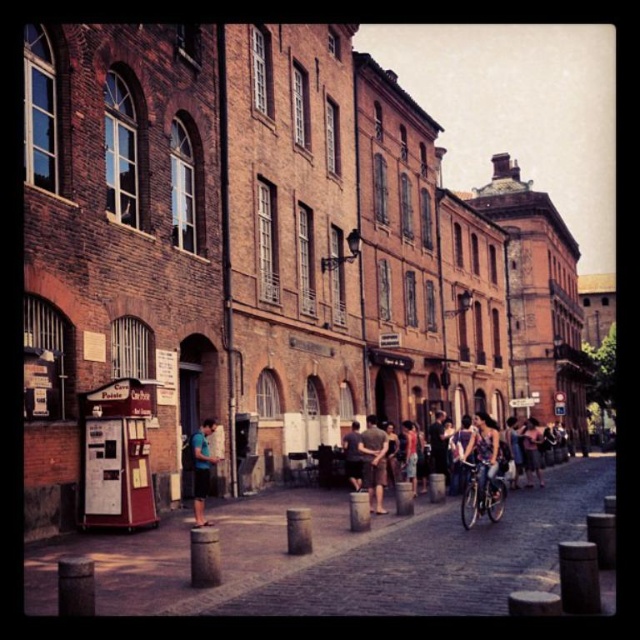
You are a delivery person who needs to park your matte purple bicycle at center near the kiosk labeled Cave Poivr?e. Is the bicycle currently positioned close enough to the kiosk to easily access it?

The matte purple bicycle at center is located at point (x=484, y=458). Since the kiosk is not mentioned in the objects description, we cannot determine the distance between them. Please provide more information about the kiosk location.

You are a tourist standing on the cobblestone street in front of the historic buildings. You spot two points marked on the ground ahead of you. The first is at coordinates point (211,426) and the second is at point (346,456). Which of these two points is closer to you?

Point (211,426) is closer to you than point (346,456).